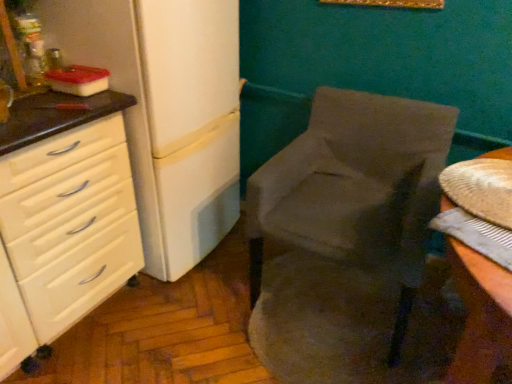
Question: Based on their sizes in the image, would you say velvet gray chair at center is bigger or smaller than white matte refrigerator at left?

Choices:
 (A) small
 (B) big

Answer: (A)

Question: Considering the positions of velvet gray chair at center and white matte refrigerator at left in the image, is velvet gray chair at center wider or thinner than white matte refrigerator at left?

Choices:
 (A) thin
 (B) wide

Answer: (B)

Question: Estimate the real-world distances between objects in this image. Which object is closer to the velvet gray chair at center?

Choices:
 (A) white glossy chest of drawers at left
 (B) white matte refrigerator at left

Answer: (B)

Question: Based on their relative distances, which object is farther from the white matte refrigerator at left?

Choices:
 (A) white glossy chest of drawers at left
 (B) velvet gray chair at center

Answer: (B)